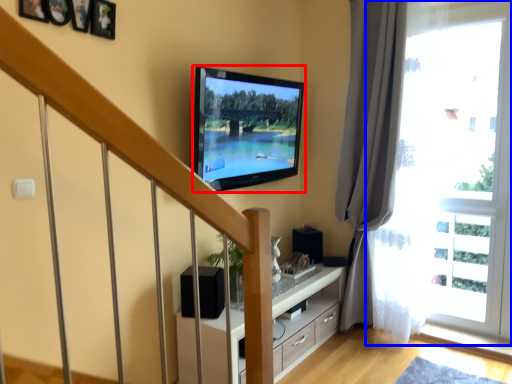
Question: Which object is closer to the camera taking this photo, television (highlighted by a red box) or window (highlighted by a blue box)?

Choices:
 (A) television
 (B) window

Answer: (A)